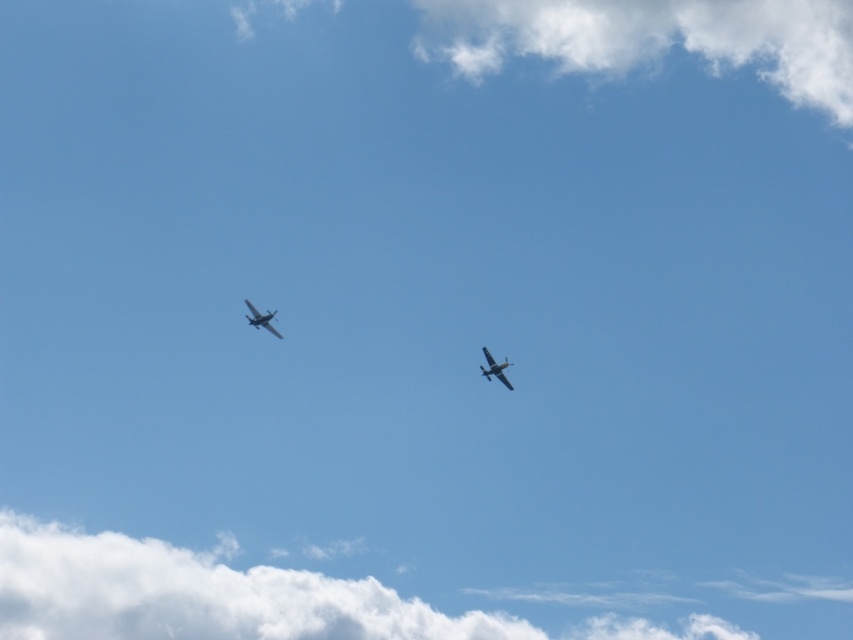
You are a pilot observing two metallic silver airplanes in the sky. You see the metallic silver airplane at upper center and the metallic silver airplane at upper left. Which one is positioned lower in the sky?

The metallic silver airplane at upper center is positioned lower than the metallic silver airplane at upper left.

You are a pilot observing two metallic silver airplanes in the sky. You notice both the metallic silver airplane at upper center and the metallic silver airplane at upper left. Which of these two airplanes is narrower in width?

The metallic silver airplane at upper center has a lesser width compared to the metallic silver airplane at upper left, so the metallic silver airplane at upper center is narrower.